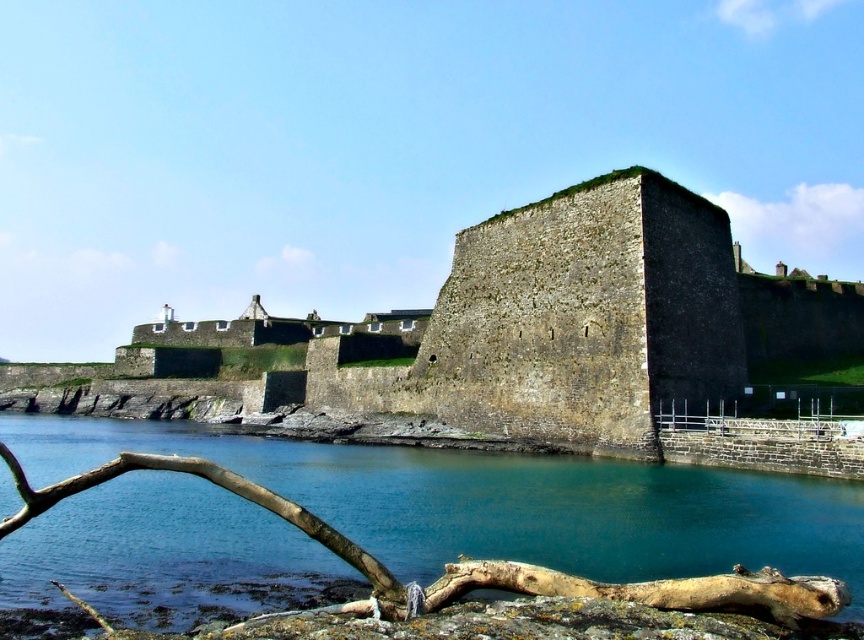
Who is shorter, brown stone wall at center or blue water at lower left?

blue water at lower left

Measure the distance between point (774,317) and camera.

Point (774,317) is 95.62 meters from camera.

At what (x,y) coordinates should I click in order to perform the action: click on brown stone wall at center. Please return your answer as a coordinate pair (x, y). The height and width of the screenshot is (640, 864). Looking at the image, I should click on coord(524,342).